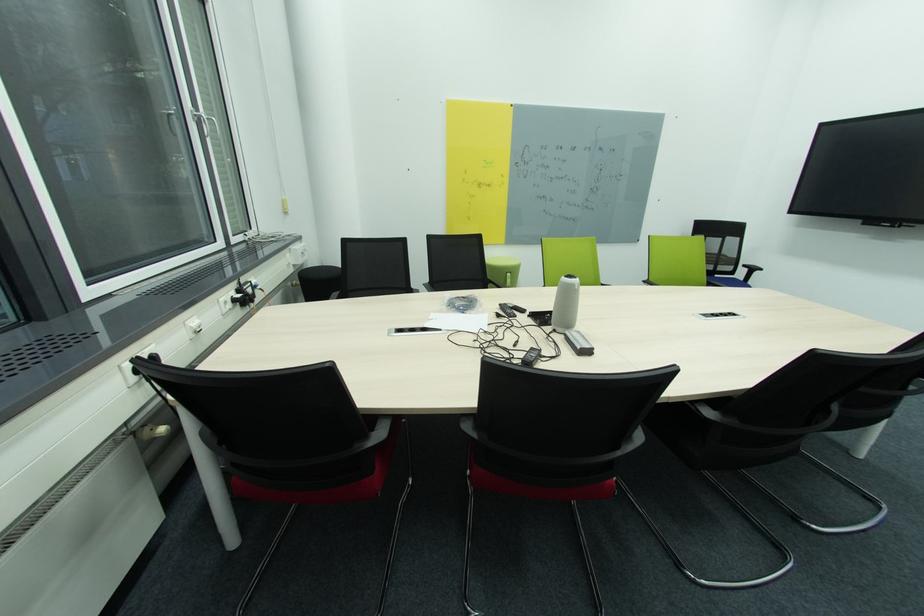
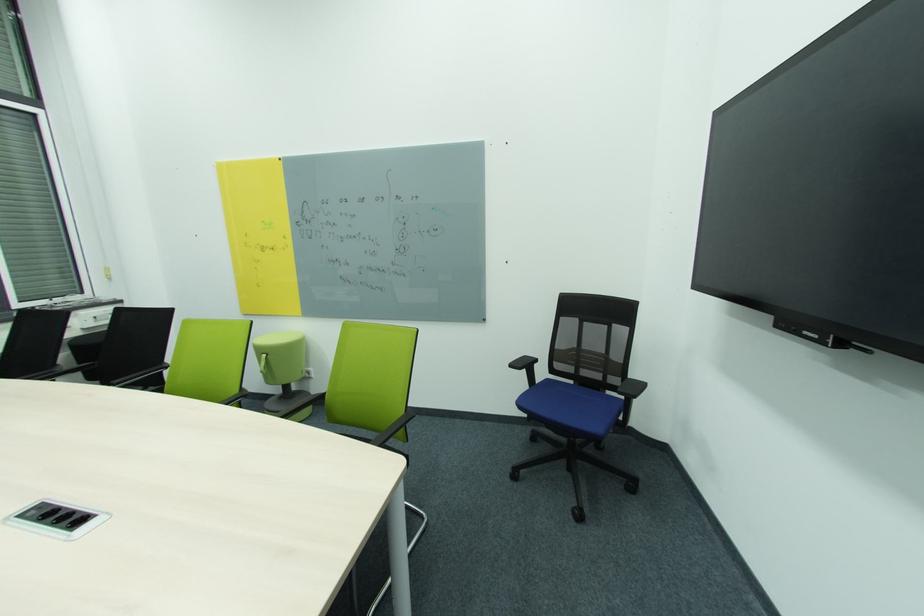
Which direction would the cameraman need to move to produce the second image?

The cameraman walked toward right, forward.